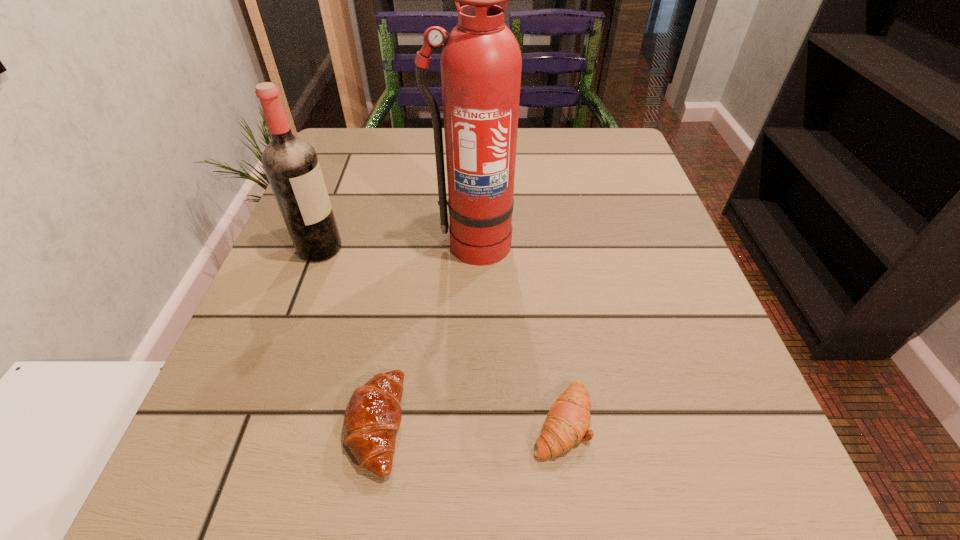
Where is `vacant area that lies between the third shortest object and the shortest object`? The height and width of the screenshot is (540, 960). vacant area that lies between the third shortest object and the shortest object is located at coordinates (441, 334).

Identify the location of free space between the fire extinguisher and the leftmost object. (396, 246).

Identify the location of empty space that is in between the shorter crescent roll and the tallest object. The width and height of the screenshot is (960, 540). click(x=516, y=333).

You are a GUI agent. You are given a task and a screenshot of the screen. Output one action in this format:
    pyautogui.click(x=<x>, y=<y>)
    Task: Click on the unoccupied area between the shortest object and the leftmost object
    The height and width of the screenshot is (540, 960).
    Given the screenshot: What is the action you would take?
    pyautogui.click(x=441, y=334)

At what (x,y) coordinates should I click in order to perform the action: click on empty location between the right crescent roll and the left crescent roll. Please return your answer as a coordinate pair (x, y). Looking at the image, I should click on (468, 422).

Find the location of a particular element. The height and width of the screenshot is (540, 960). free space between the second object from left to right and the shorter crescent roll is located at coordinates (468, 422).

At what (x,y) coordinates should I click in order to perform the action: click on free space between the third object from left to right and the leftmost object. Please return your answer as a coordinate pair (x, y). Looking at the image, I should click on (396, 246).

Find the location of a particular element. free space between the rightmost object and the second object from right to left is located at coordinates (516, 333).

The width and height of the screenshot is (960, 540). I want to click on vacant area between the shortest object and the second object from left to right, so click(x=468, y=422).

The width and height of the screenshot is (960, 540). In order to click on object identified as the second closest to the right crescent roll in this screenshot , I will do `click(481, 63)`.